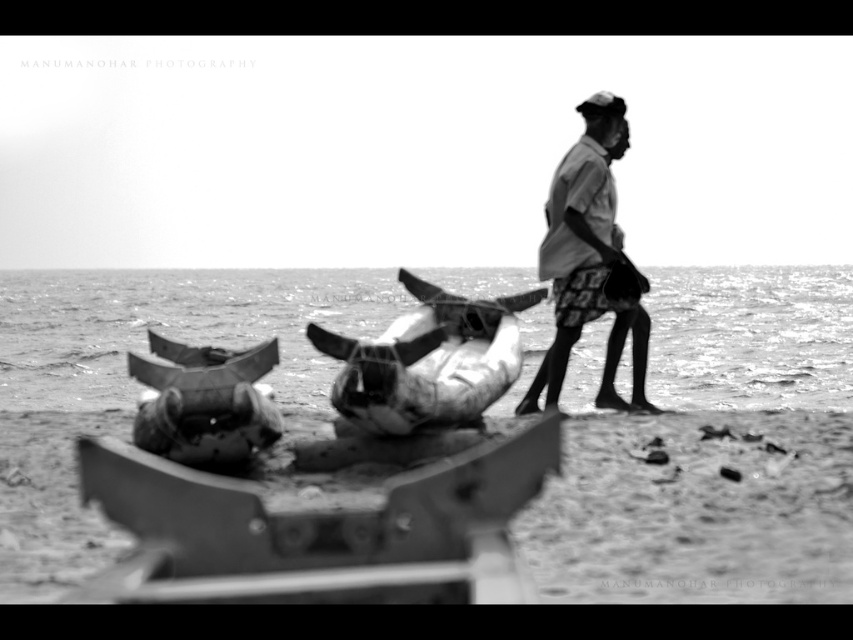
Based on the coordinates provided, which object is located at point (428,360) in the image?

The point (428,360) corresponds to the rusty metal boat at center.

You are a photographer trying to capture the rusty metal boat at center and the light gray fabric shirt at right in the same frame. Based on their heights, which one would appear smaller in your photo?

The rusty metal boat at center has a lesser height compared to the light gray fabric shirt at right, so it would appear smaller in the photo.